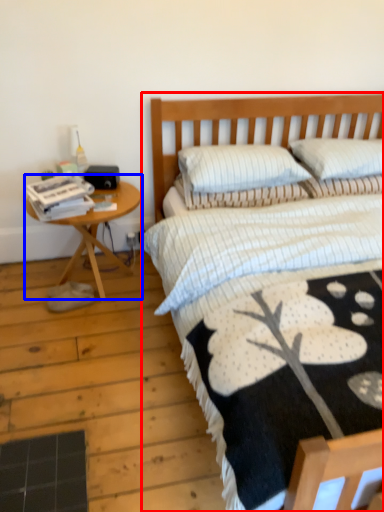
Question: Among these objects, which one is farthest to the camera, bed (highlighted by a red box) or table (highlighted by a blue box)?

Choices:
 (A) bed
 (B) table

Answer: (B)